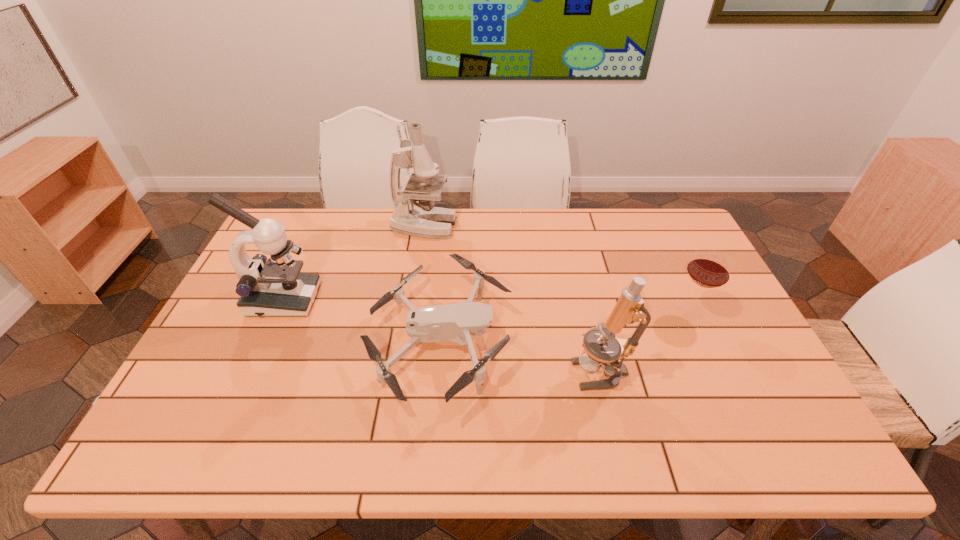
Where is `the farthest microscope`? the farthest microscope is located at coordinates (424, 220).

This screenshot has height=540, width=960. What are the coordinates of `the farthest object` in the screenshot? It's located at (424, 220).

Where is `the second farthest microscope`? The width and height of the screenshot is (960, 540). the second farthest microscope is located at coordinates (267, 287).

At what (x,y) coordinates should I click in order to perform the action: click on the leftmost microscope. Please return your answer as a coordinate pair (x, y). The width and height of the screenshot is (960, 540). Looking at the image, I should click on (267, 287).

Where is `the second object from right to left`? Image resolution: width=960 pixels, height=540 pixels. the second object from right to left is located at coordinates (629, 308).

Find the location of `the nearest microscope`. the nearest microscope is located at coordinates (629, 308).

This screenshot has width=960, height=540. Find the location of `the rightmost object`. the rightmost object is located at coordinates (709, 268).

This screenshot has height=540, width=960. I want to click on the fourth tallest object, so click(x=709, y=268).

Locate an element on the screen. the shortest object is located at coordinates (451, 322).

This screenshot has width=960, height=540. I want to click on blank area located on the front of the farthest microscope, so click(414, 290).